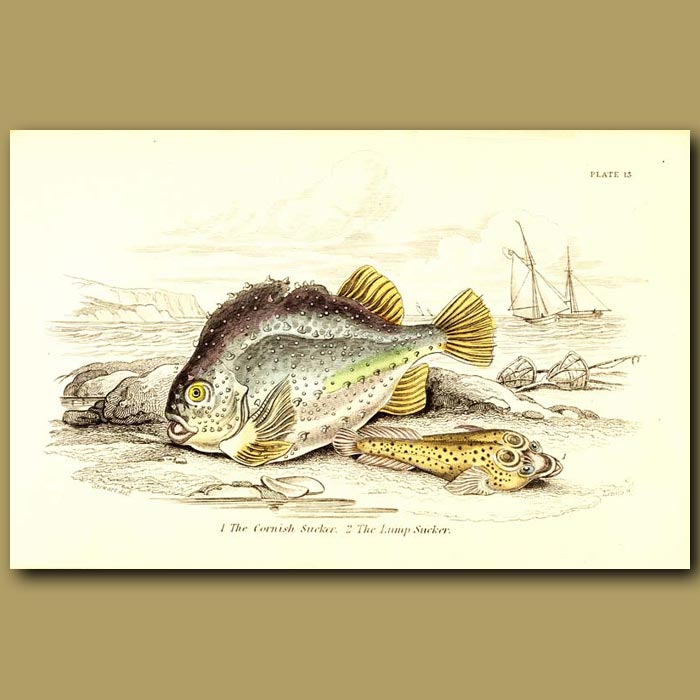
The width and height of the screenshot is (700, 700). Identify the location of painting. tap(372, 395).